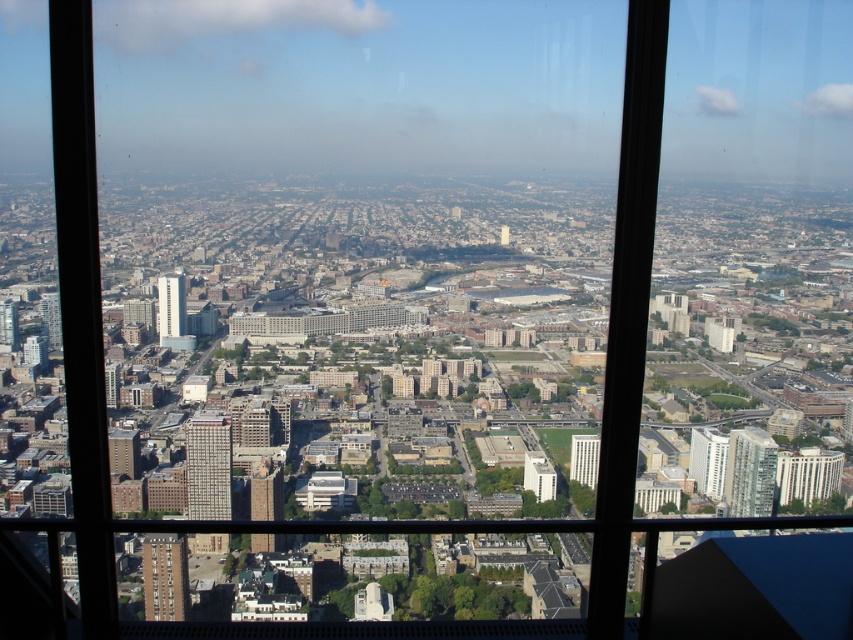
Question: Which object is closer to the camera taking this photo?

Choices:
 (A) brick textured building at center
 (B) brick building at center

Answer: (B)

Question: Is white glass skyscraper at center-left to the right of light gray concrete building at center from the viewer's perspective?

Choices:
 (A) yes
 (B) no

Answer: (B)

Question: Is brick textured building at center positioned before white concrete building at center?

Choices:
 (A) no
 (B) yes

Answer: (A)

Question: Among these points, which one is nearest to the camera?

Choices:
 (A) (151, 573)
 (B) (500, 236)
 (C) (595, 465)

Answer: (B)

Question: Which point is closer to the camera?

Choices:
 (A) light beige concrete building at center
 (B) white glass skyscraper at center-left
 (C) brick textured building at center

Answer: (A)

Question: Is matte brown building at lower left to the left of white concrete building at center from the viewer's perspective?

Choices:
 (A) yes
 (B) no

Answer: (A)